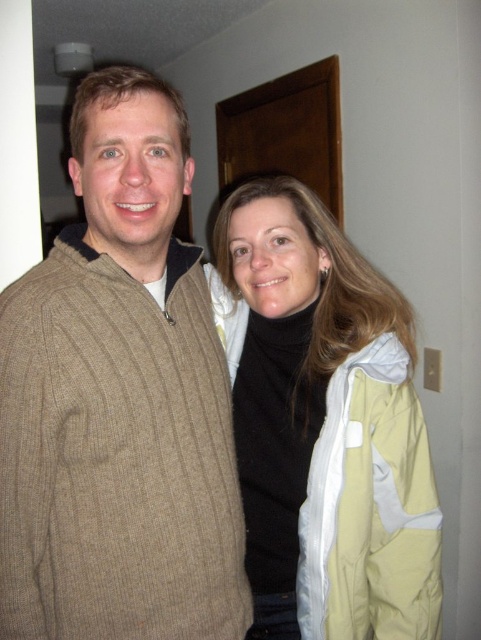
Is knit sweater at left to the left of light yellow jacket at center from the viewer's perspective?

Indeed, knit sweater at left is positioned on the left side of light yellow jacket at center.

Describe the element at coordinates (118, 401) in the screenshot. The height and width of the screenshot is (640, 481). I see `knit sweater at left` at that location.

Where is `knit sweater at left`? Image resolution: width=481 pixels, height=640 pixels. knit sweater at left is located at coordinates (118, 401).

You are a GUI agent. You are given a task and a screenshot of the screen. Output one action in this format:
    pyautogui.click(x=<x>, y=<y>)
    Task: Click on the knit sweater at left
    The height and width of the screenshot is (640, 481).
    Given the screenshot: What is the action you would take?
    pyautogui.click(x=118, y=401)